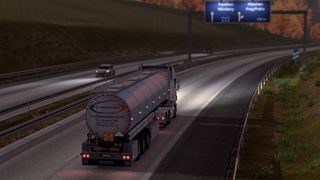
The height and width of the screenshot is (180, 320). I want to click on side rails, so click(x=48, y=110), click(x=270, y=74), click(x=27, y=72).